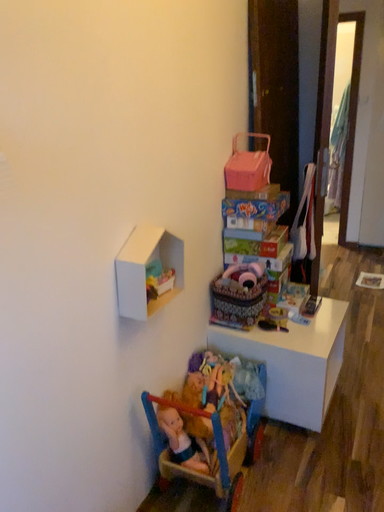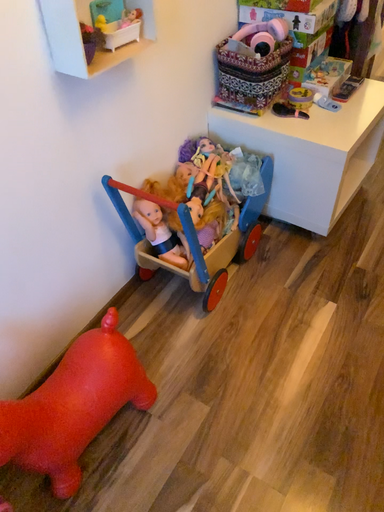
Question: How did the camera likely rotate when shooting the video?

Choices:
 (A) rotated downward
 (B) rotated upward

Answer: (A)